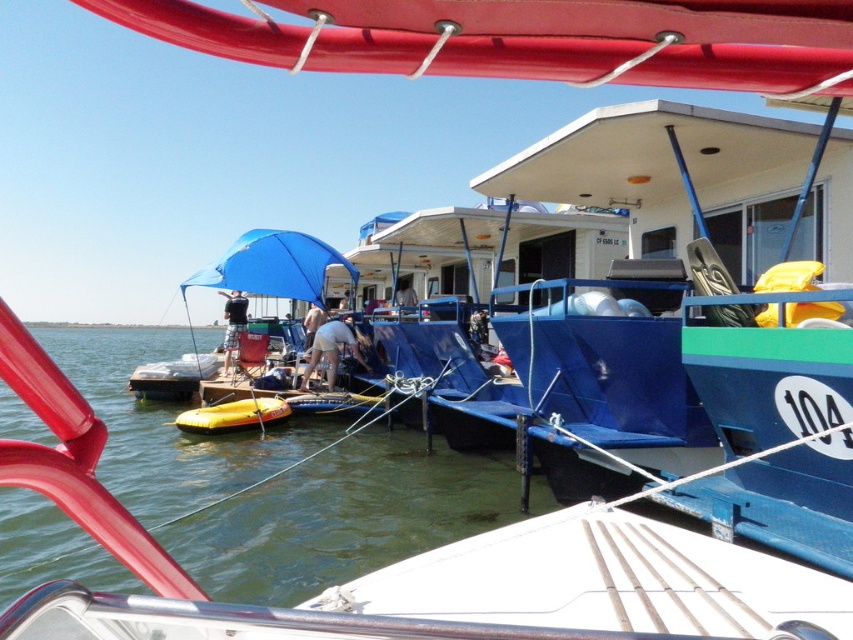
Does green water at lower left appear over blue fabric umbrella at left?

Incorrect, green water at lower left is not positioned above blue fabric umbrella at left.

Can you confirm if green water at lower left is smaller than blue fabric umbrella at left?

Incorrect, green water at lower left is not smaller in size than blue fabric umbrella at left.

Who is more distant from viewer, (311, 572) or (234, 257)?

Point (234, 257)

Locate an element on the screen. green water at lower left is located at coordinates (274, 483).